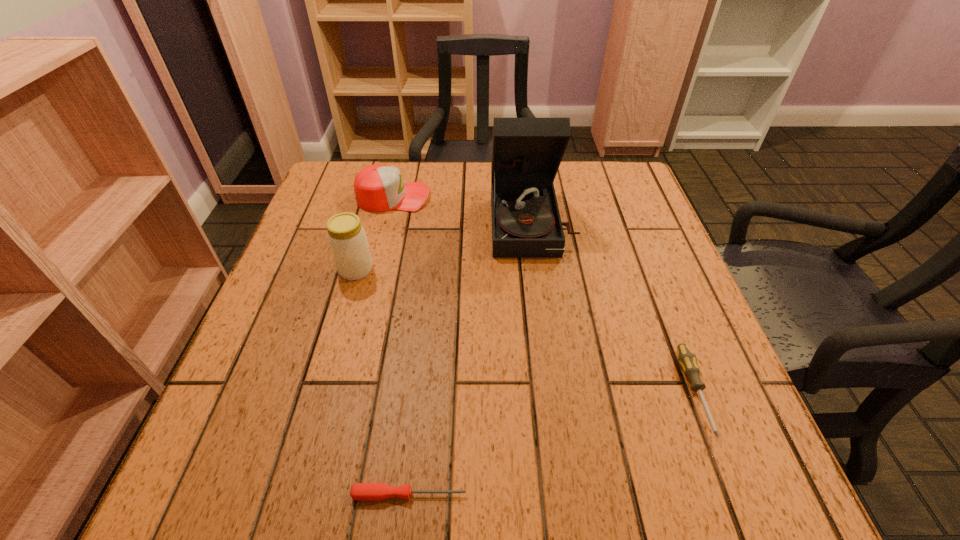
Where is `object situated at the near right corner`? The image size is (960, 540). object situated at the near right corner is located at coordinates (686, 358).

Locate an element on the screen. The height and width of the screenshot is (540, 960). blank space at the far edge of the desktop is located at coordinates (403, 161).

Identify the location of vacant space at the near edge of the desktop. (481, 443).

Locate an element on the screen. This screenshot has height=540, width=960. free location at the left edge is located at coordinates (237, 407).

At what (x,y) coordinates should I click in order to perform the action: click on vacant position at the right edge of the desktop. Please return your answer as a coordinate pair (x, y). Looking at the image, I should click on (606, 253).

Locate an element on the screen. Image resolution: width=960 pixels, height=540 pixels. vacant space at the far left corner of the desktop is located at coordinates (349, 167).

In order to click on free space at the far right corner of the desktop in this screenshot , I will do click(635, 210).

In order to click on vacant space that is in between the baseball cap and the fourth object from left to right in this screenshot , I will do `click(463, 210)`.

Identify the location of vacant space that is in between the baseball cap and the fourth tallest object. (544, 294).

Where is `empty location between the baseball cap and the left screwdriver`? Image resolution: width=960 pixels, height=540 pixels. empty location between the baseball cap and the left screwdriver is located at coordinates (401, 346).